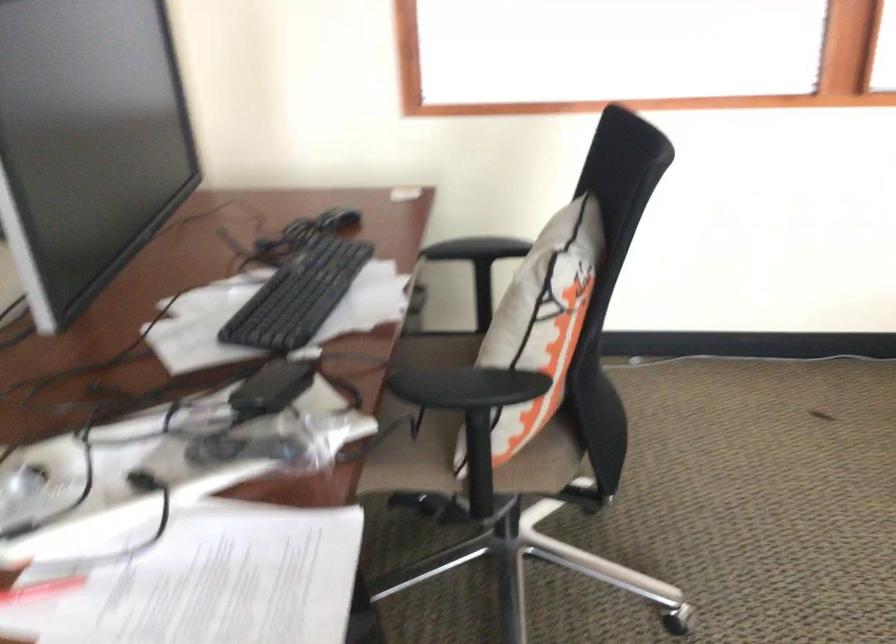
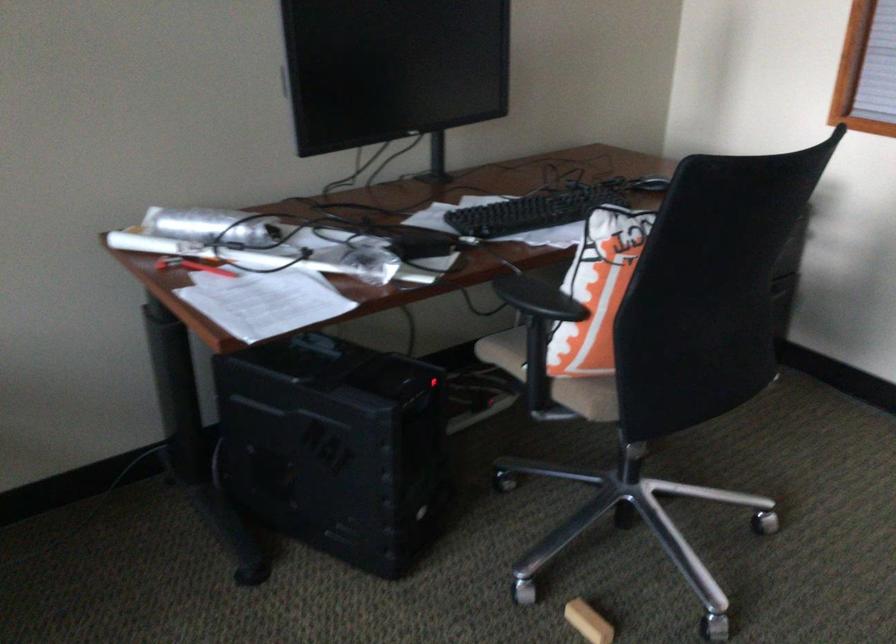
The point at [314,290] is marked in the first image. Where is the corresponding point in the second image?

(532, 211)